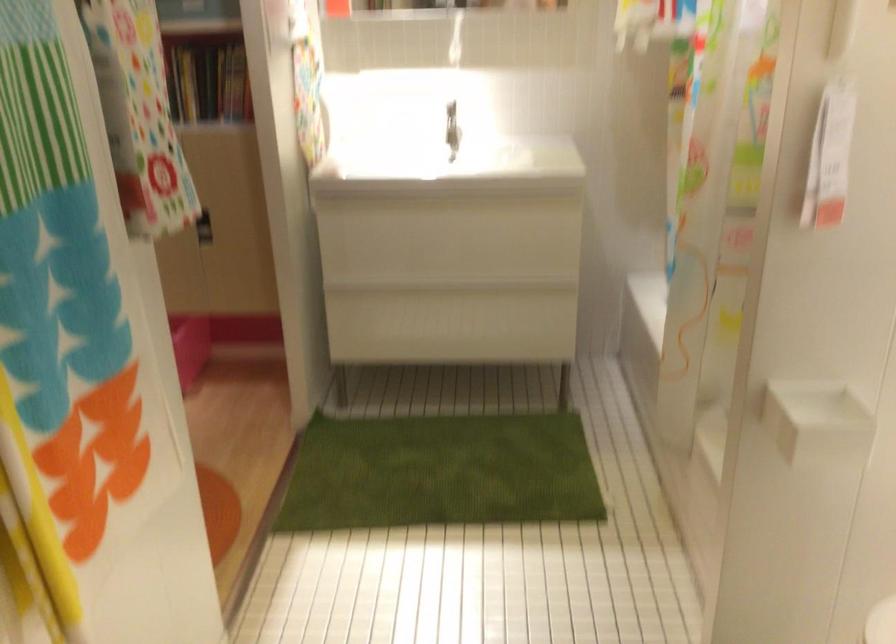
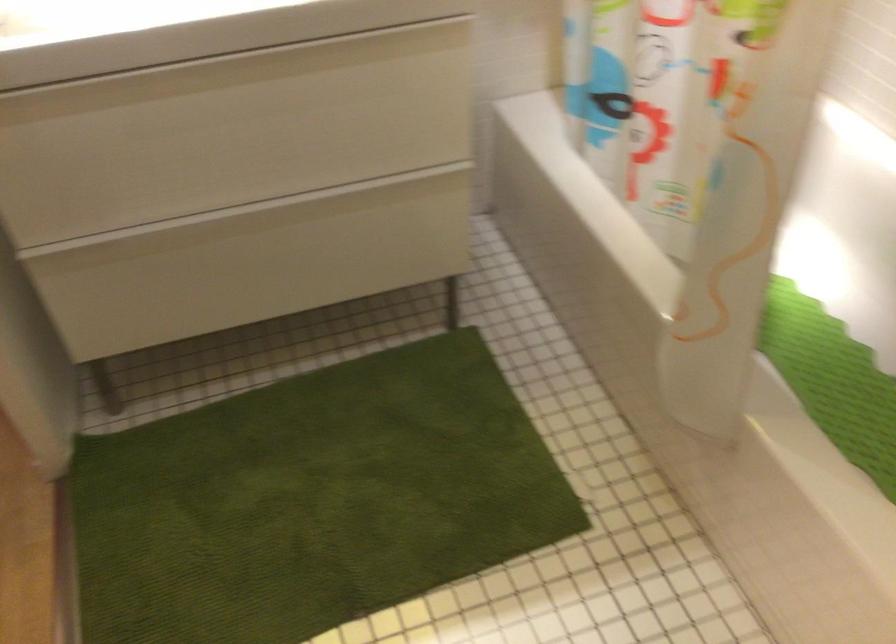
The point at (727, 297) is marked in the first image. Where is the corresponding point in the second image?

(700, 161)